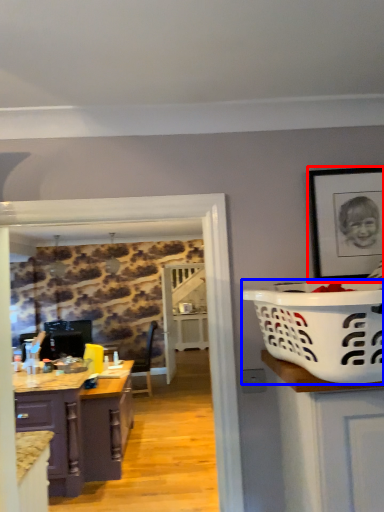
Question: Among these objects, which one is farthest to the camera, picture frame (highlighted by a red box) or basket container (highlighted by a blue box)?

Choices:
 (A) picture frame
 (B) basket container

Answer: (A)